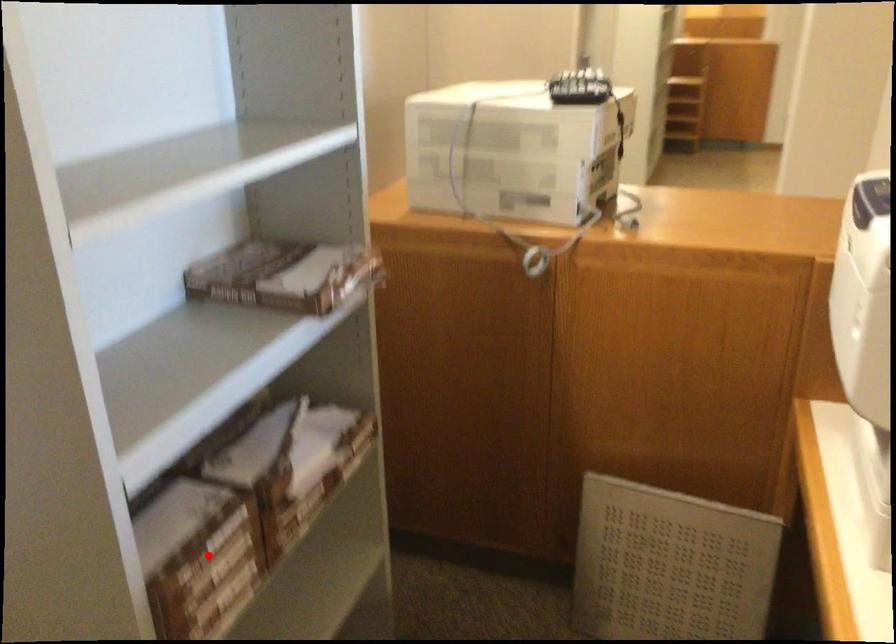
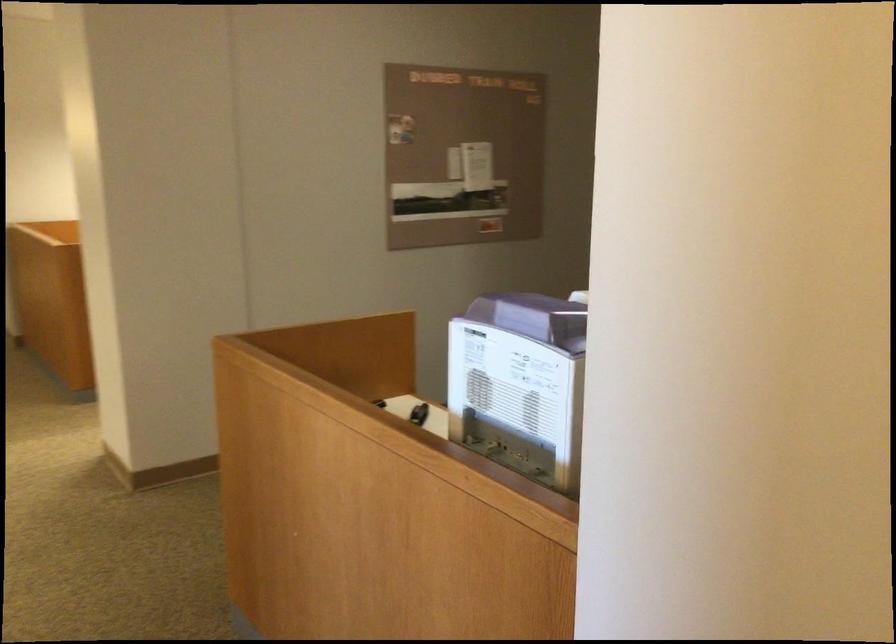
Question: I am providing you with two images of the same scene from different viewpoints. A red point is marked on the first image. Is the red point's position out of view in image 2?

Choices:
 (A) Yes
 (B) No

Answer: (A)